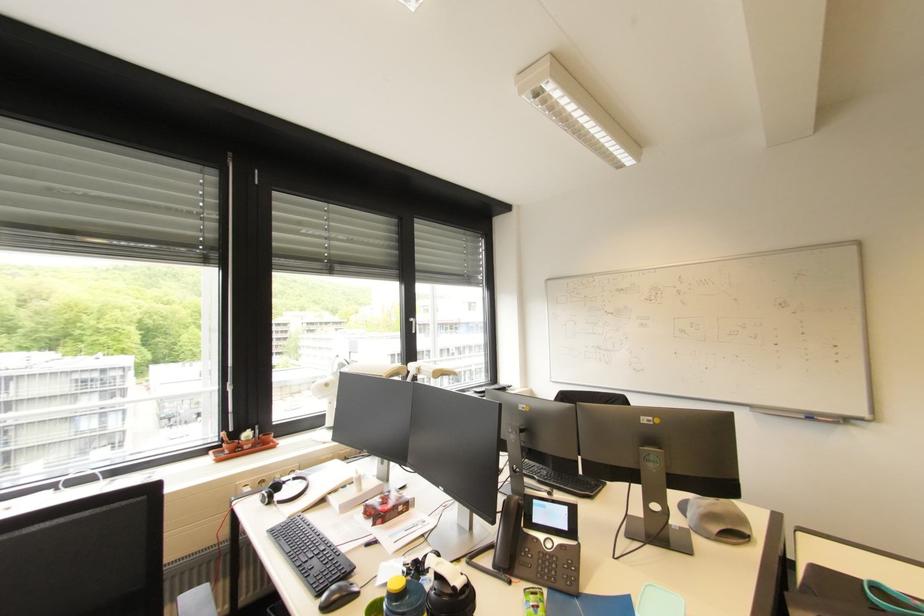
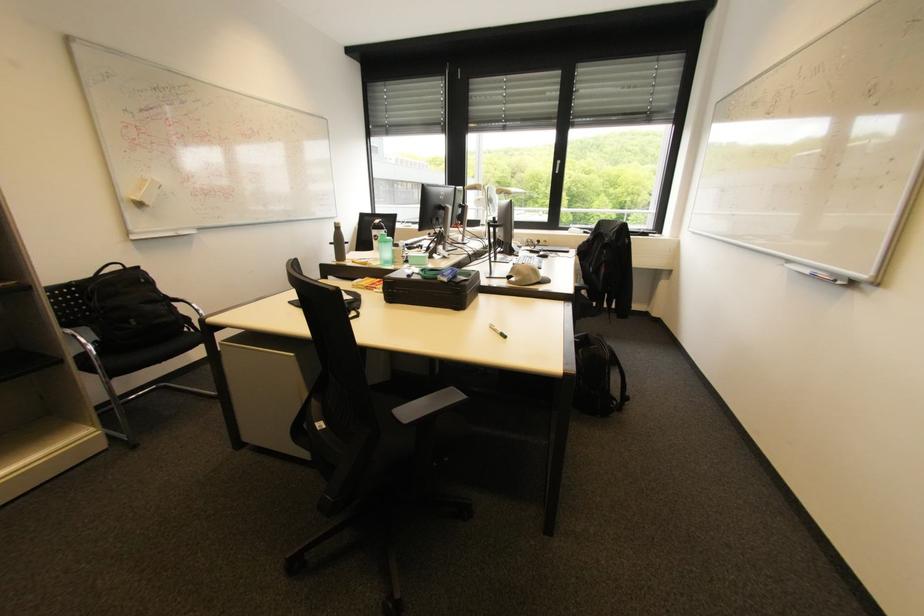
Question: I am providing you with two images of the same scene from different viewpoints. After the viewpoint changes to image2, which objects are now occluded?

Choices:
 (A) light fixture pull-chain
 (B) black chair armrest
 (C) black headphones
 (D) grey baseball cap

Answer: (C)